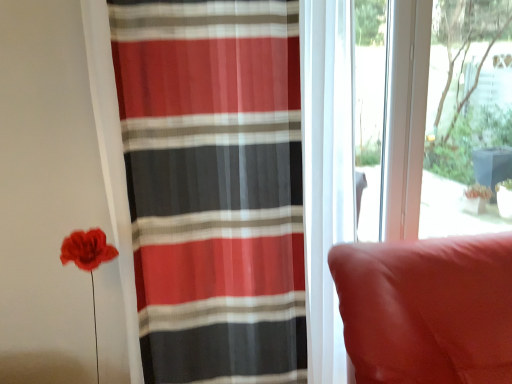
Question: Are striped sheer curtain at left and suede-like red cushion at right beside each other?

Choices:
 (A) no
 (B) yes

Answer: (A)

Question: Considering the relative sizes of striped sheer curtain at left and suede-like red cushion at right in the image provided, is striped sheer curtain at left thinner than suede-like red cushion at right?

Choices:
 (A) no
 (B) yes

Answer: (B)

Question: Is striped sheer curtain at left at the right side of suede-like red cushion at right?

Choices:
 (A) no
 (B) yes

Answer: (A)

Question: From a real-world perspective, does striped sheer curtain at left stand above suede-like red cushion at right?

Choices:
 (A) yes
 (B) no

Answer: (A)

Question: Is striped sheer curtain at left turned away from suede-like red cushion at right?

Choices:
 (A) yes
 (B) no

Answer: (B)

Question: Is striped sheer curtain at left further to the viewer compared to suede-like red cushion at right?

Choices:
 (A) yes
 (B) no

Answer: (A)

Question: Could suede-like red cushion at right be considered to be inside transparent glass window screen at upper right?

Choices:
 (A) yes
 (B) no

Answer: (B)

Question: From a real-world perspective, does transparent glass window screen at upper right stand above suede-like red cushion at right?

Choices:
 (A) yes
 (B) no

Answer: (A)

Question: Considering the relative sizes of transparent glass window screen at upper right and suede-like red cushion at right in the image provided, is transparent glass window screen at upper right wider than suede-like red cushion at right?

Choices:
 (A) yes
 (B) no

Answer: (B)

Question: Is transparent glass window screen at upper right at the left side of suede-like red cushion at right?

Choices:
 (A) no
 (B) yes

Answer: (A)

Question: Can you confirm if transparent glass window screen at upper right is smaller than suede-like red cushion at right?

Choices:
 (A) yes
 (B) no

Answer: (A)

Question: From the image's perspective, is transparent glass window screen at upper right under suede-like red cushion at right?

Choices:
 (A) yes
 (B) no

Answer: (B)

Question: Is striped sheer curtain at left at the right side of transparent glass window screen at upper right?

Choices:
 (A) yes
 (B) no

Answer: (B)